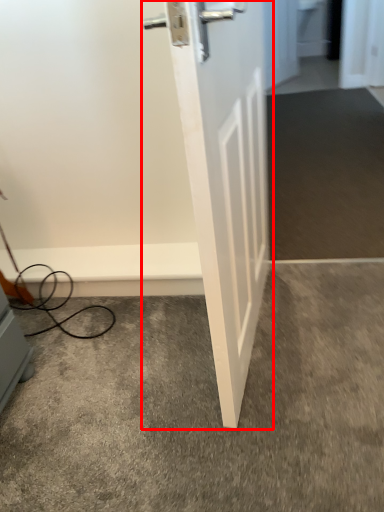
Question: In this image, where is door (annotated by the red box) located relative to concrete?

Choices:
 (A) right
 (B) left

Answer: (A)